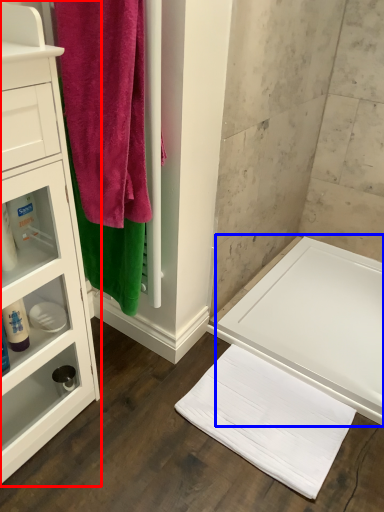
Question: Among these objects, which one is farthest to the camera, bathroom cabinet (highlighted by a red box) or bath (highlighted by a blue box)?

Choices:
 (A) bathroom cabinet
 (B) bath

Answer: (B)